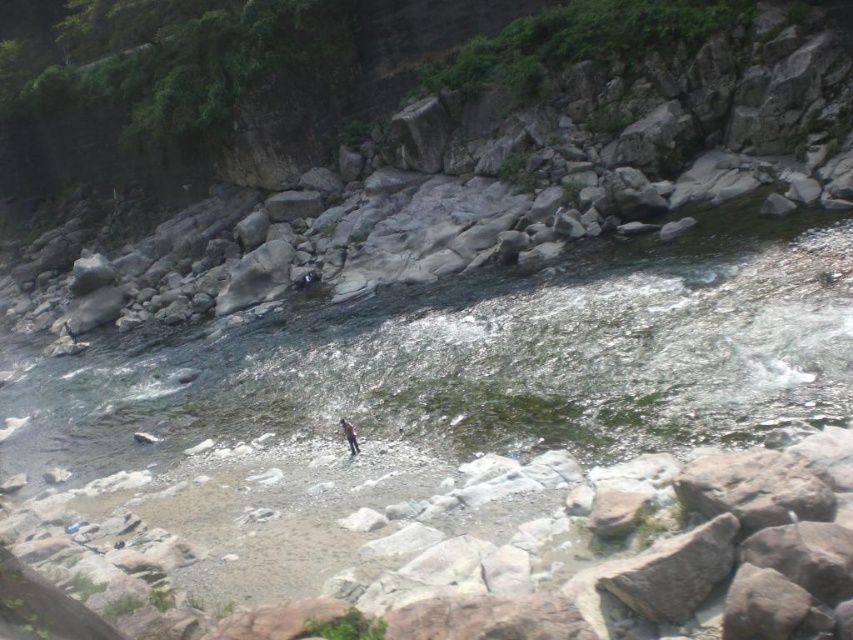
You are standing on the rocky riverbank and see the clear water at stream center and the dark gray fabric person at center. Which object is located to the right of the other?

The dark gray fabric person at center is positioned to the right of the clear water at stream center.

You are standing at the edge of the river and see the clear water at stream center and the dark gray fabric person at center. Which object is higher in elevation?

The clear water at stream center is above the dark gray fabric person at center, so it has a higher elevation.

You are planning to cross the river using a small boat that requires at least 10 feet of clearance between the clear water at stream center and the dark gray fabric person at center. Can your boat safely navigate this section of the river?

The distance between the clear water at stream center and the dark gray fabric person at center is 22.71 feet, which is more than the required 10 feet of clearance. Therefore, the boat can safely navigate this section of the river.